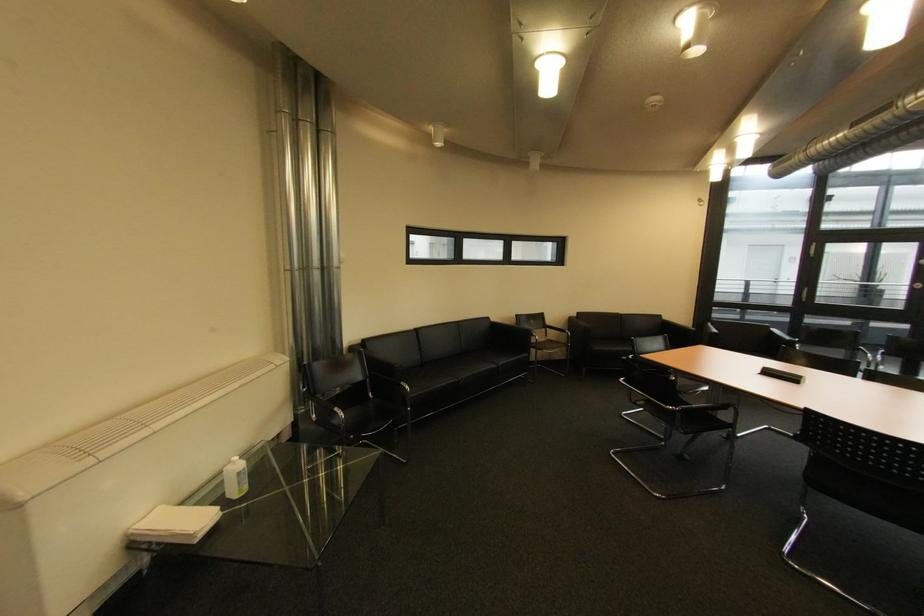
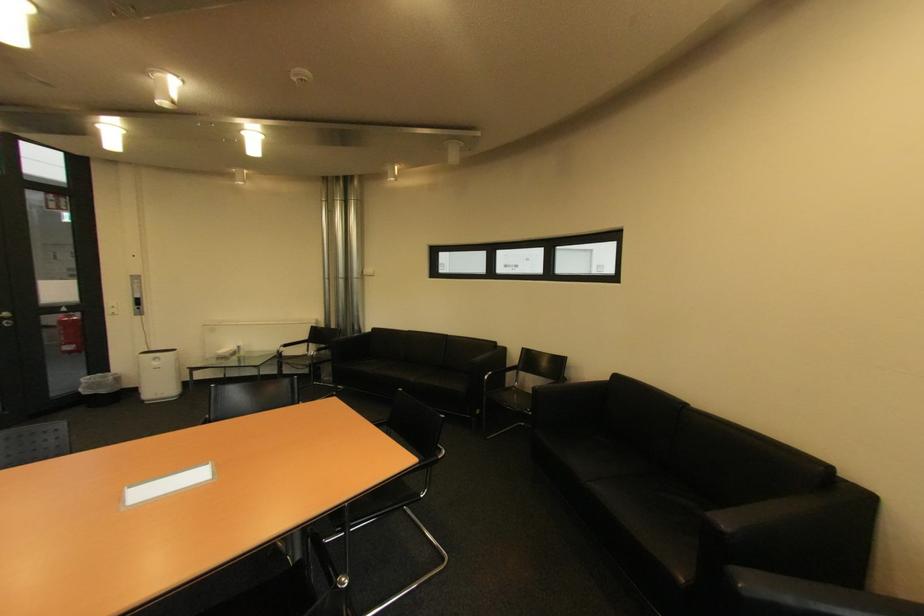
Find the pixel in the second image that matches (x=586, y=315) in the first image.

(625, 378)